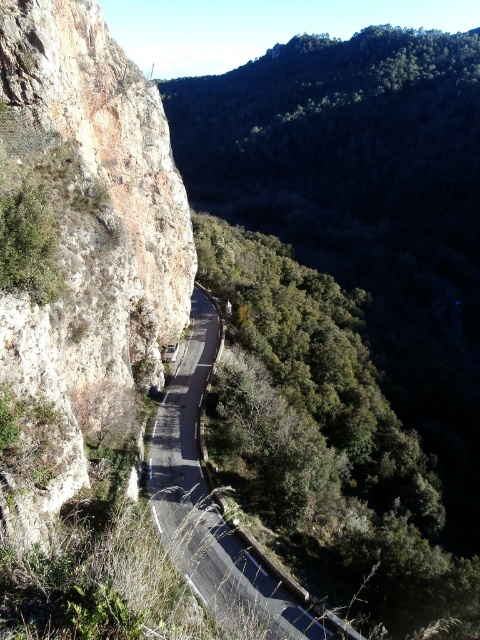
You are driving along the asphalt road at center and want to park your car near the rusty rock cliff at left. Is the cliff accessible from your current position?

The rusty rock cliff at left is closer to the viewer than asphalt road at center, so yes, the cliff is accessible from your current position on the asphalt road at center.

You are a hiker planning to cross the asphalt road at center to reach the forest on the right. The path you want to take is directly in front of the rusty rock cliff at left. Considering the distance between them, is there enough space for you to safely walk around the cliff and onto the road?

The distance between the rusty rock cliff at left and asphalt road at center is 42.38 feet, which provides ample space for a hiker to safely navigate around the cliff and onto the road.

You are driving along the winding road and notice a point marked at coordinates (79,252). What does this point indicate?

The point at coordinates (79,252) marks the location of the rusty rock cliff at left.